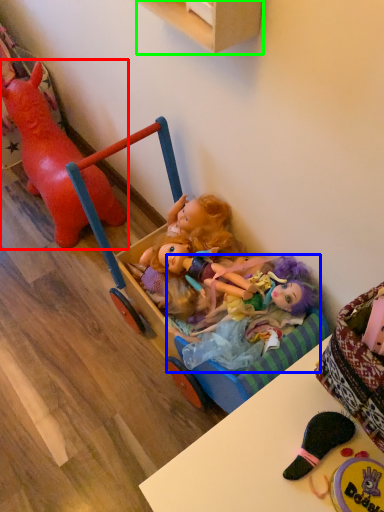
Question: Based on their relative distances, which object is farther from toy (highlighted by a red box)? Choose from doll (highlighted by a blue box) and cabinetry (highlighted by a green box).

Choices:
 (A) doll
 (B) cabinetry

Answer: (A)